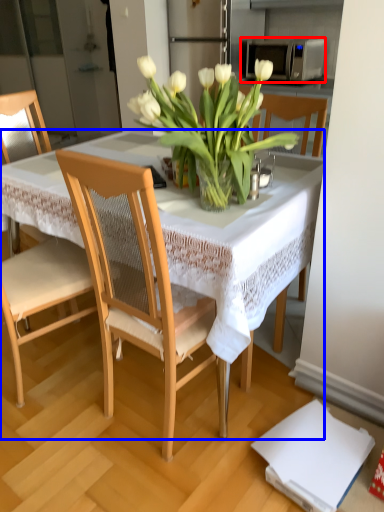
Question: Which object is closer to the camera taking this photo, microwave oven (highlighted by a red box) or table (highlighted by a blue box)?

Choices:
 (A) microwave oven
 (B) table

Answer: (B)